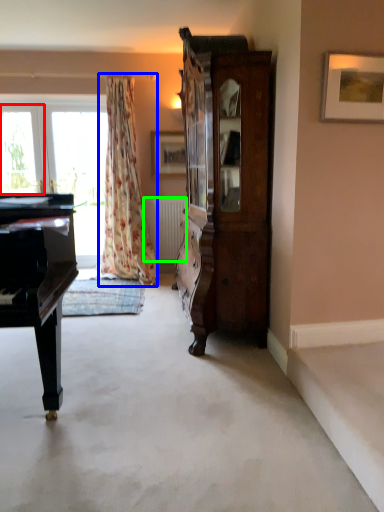
Question: Based on their relative distances, which object is farther from window (highlighted by a red box)? Choose from curtain (highlighted by a blue box) and radiator (highlighted by a green box).

Choices:
 (A) curtain
 (B) radiator

Answer: (B)